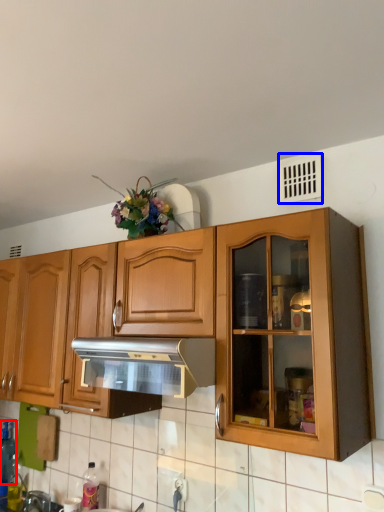
Question: Which object is closer to the camera taking this photo, bottle (highlighted by a red box) or window (highlighted by a blue box)?

Choices:
 (A) bottle
 (B) window

Answer: (B)